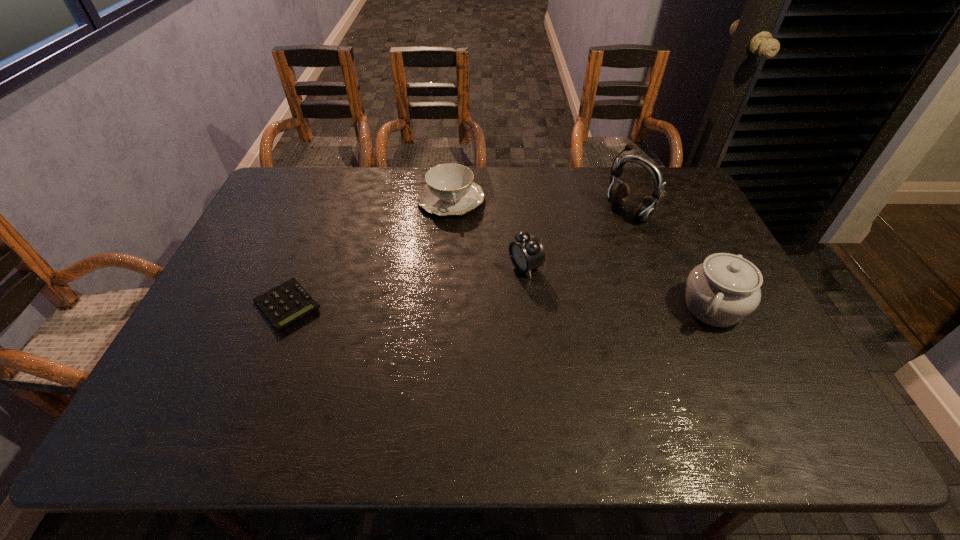
Where is `the shortest object`? Image resolution: width=960 pixels, height=540 pixels. the shortest object is located at coordinates (288, 302).

I want to click on calculator, so click(x=288, y=302).

Locate an element on the screen. The width and height of the screenshot is (960, 540). the taller chinaware is located at coordinates (725, 289).

Image resolution: width=960 pixels, height=540 pixels. Find the location of `the right chinaware`. the right chinaware is located at coordinates (725, 289).

At what (x,y) coordinates should I click in order to perform the action: click on the third object from left to right. Please return your answer as a coordinate pair (x, y). Looking at the image, I should click on (526, 253).

You are a GUI agent. You are given a task and a screenshot of the screen. Output one action in this format:
    pyautogui.click(x=<x>, y=<y>)
    Task: Click on the alarm clock
    The height and width of the screenshot is (540, 960).
    Given the screenshot: What is the action you would take?
    pyautogui.click(x=526, y=253)

Where is `the tallest object`? The image size is (960, 540). the tallest object is located at coordinates (618, 194).

What are the coordinates of `the farther chinaware` in the screenshot? It's located at (449, 190).

Identify the location of the second object from left to right. pos(449,190).

Where is `vacant space located 0.090m on the front of the calculator`? The height and width of the screenshot is (540, 960). vacant space located 0.090m on the front of the calculator is located at coordinates (264, 365).